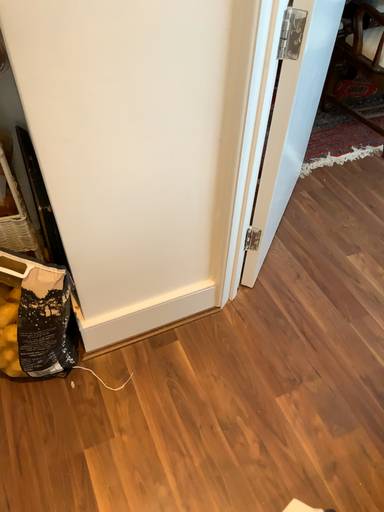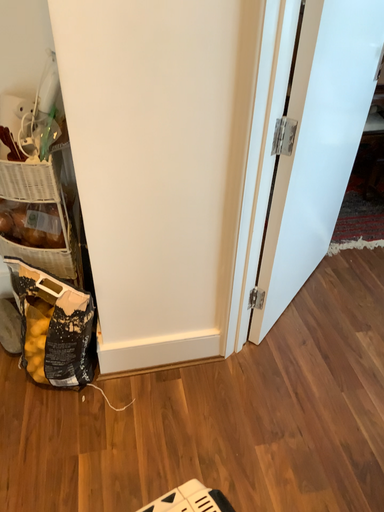
Question: Which way did the camera rotate in the video?

Choices:
 (A) rotated downward
 (B) rotated upward

Answer: (B)